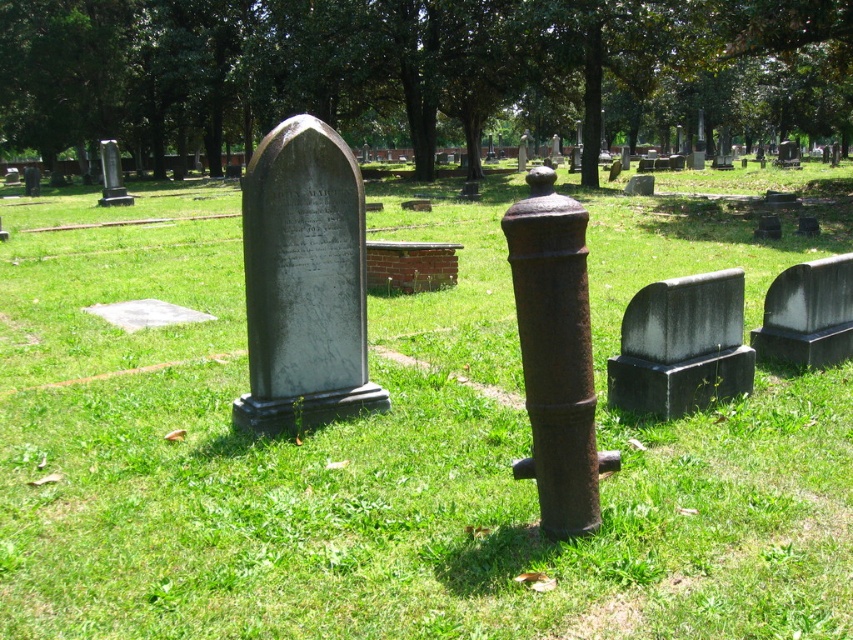
You are a groundskeeper measuring the width of the gray polished stone gravestone at center and the brick at center in the cemetery. Which object has a smaller width?

The gray polished stone gravestone at center has a lesser width compared to the brick at center, so the gray polished stone gravestone at center is smaller in width.